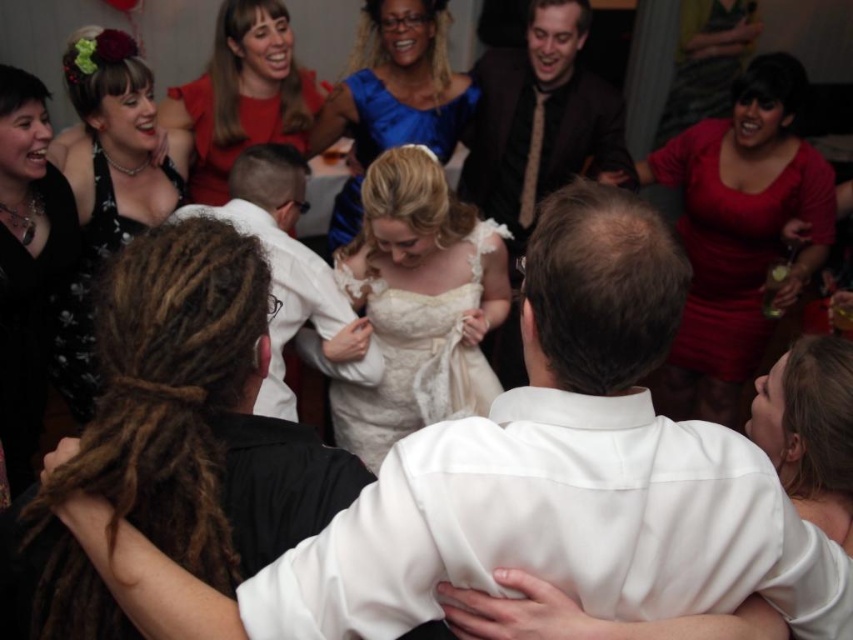
This screenshot has width=853, height=640. What do you see at coordinates (393, 97) in the screenshot? I see `satin blue dress at center` at bounding box center [393, 97].

Locate an element on the screen. satin blue dress at center is located at coordinates (393, 97).

Between point (450, 138) and point (822, 413), which one is positioned in front?

Positioned in front is point (822, 413).

The height and width of the screenshot is (640, 853). Find the location of `satin blue dress at center`. satin blue dress at center is located at coordinates (393, 97).

Is point (119, 244) farther from viewer compared to point (22, 435)?

Yes, it is behind point (22, 435).

I want to click on black lace dress at upper left, so click(106, 189).

Image resolution: width=853 pixels, height=640 pixels. Identify the location of black lace dress at upper left. (106, 189).

Locate an element on the screen. black lace dress at upper left is located at coordinates 106,189.

Is point (218, 104) positioned behind point (344, 372)?

Yes, point (218, 104) is farther from viewer.

Who is more distant from viewer, (241, 6) or (335, 285)?

The point (241, 6) is behind.

You are a GUI agent. You are given a task and a screenshot of the screen. Output one action in this format:
    pyautogui.click(x=<x>, y=<y>)
    Task: Click on the matte red dress at upper left
    Image resolution: width=853 pixels, height=640 pixels.
    Given the screenshot: What is the action you would take?
    pyautogui.click(x=242, y=93)